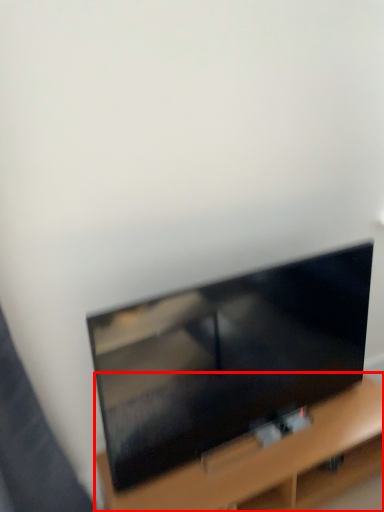
Question: From the image's perspective, what is the correct spatial relationship of furniture (annotated by the red box) in relation to television?

Choices:
 (A) below
 (B) above

Answer: (A)